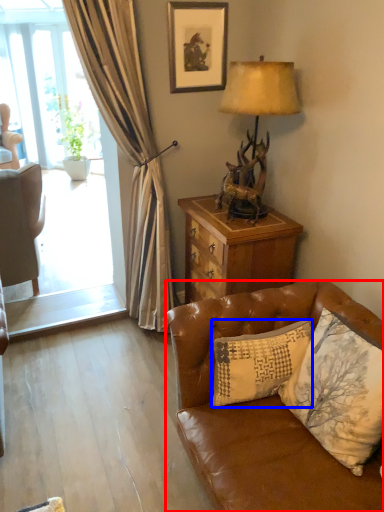
Question: Which of the following is the closest to the observer, studio couch (highlighted by a red box) or pillow (highlighted by a blue box)?

Choices:
 (A) studio couch
 (B) pillow

Answer: (A)